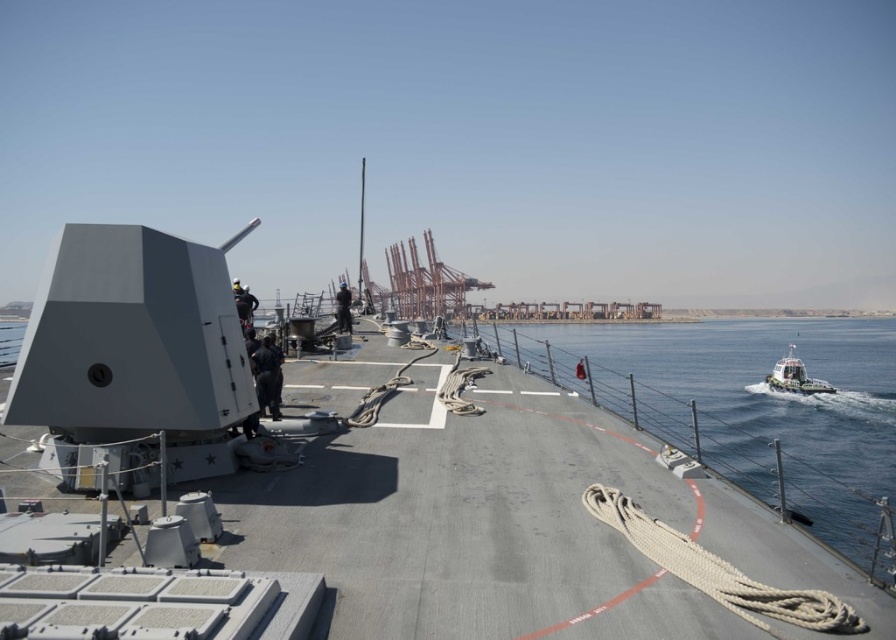
Question: Does dark blue uniform at center have a greater width compared to metallic figure at center?

Choices:
 (A) no
 (B) yes

Answer: (A)

Question: Based on their relative distances, which object is farther from the dark blue uniform at center?

Choices:
 (A) clear blue water at right
 (B) white glossy boat at right
 (C) metallic figure at center

Answer: (A)

Question: Is the position of clear blue water at right less distant than that of dark blue uniform at center?

Choices:
 (A) no
 (B) yes

Answer: (B)

Question: Which point is farther to the camera?

Choices:
 (A) white glossy boat at right
 (B) dark blue uniform at center
 (C) clear blue water at right
 (D) metallic figure at center

Answer: (A)

Question: Among these points, which one is nearest to the camera?

Choices:
 (A) (340, 320)
 (B) (256, 376)
 (C) (790, 369)

Answer: (B)

Question: Is dark blue uniform at center below white glossy boat at right?

Choices:
 (A) no
 (B) yes

Answer: (A)